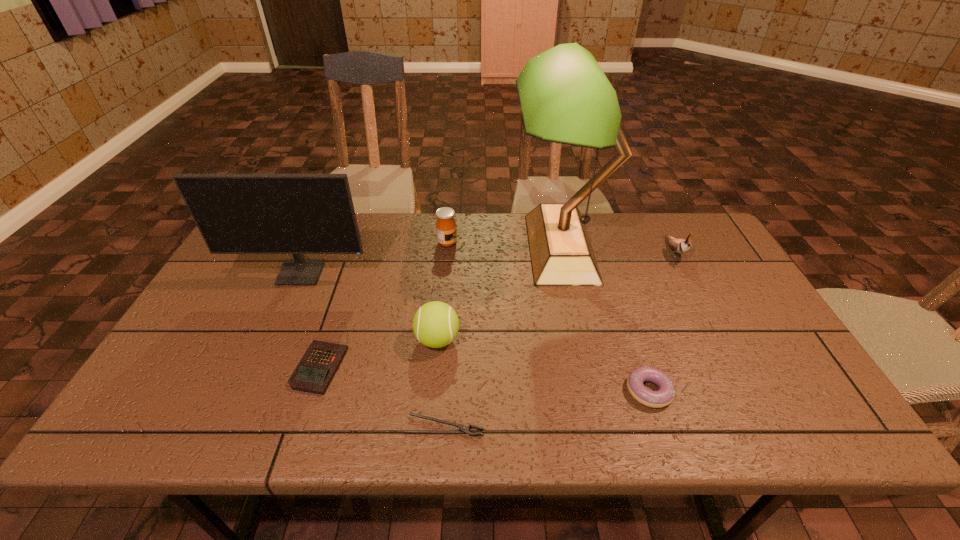
Where is `table lamp`? This screenshot has width=960, height=540. table lamp is located at coordinates (565, 97).

Where is `computer monitor`? The height and width of the screenshot is (540, 960). computer monitor is located at coordinates (297, 214).

This screenshot has height=540, width=960. Identify the location of honey. (446, 231).

Locate an element on the screen. This screenshot has width=960, height=540. bird is located at coordinates (681, 246).

The height and width of the screenshot is (540, 960). I want to click on tennis ball, so click(435, 324).

The height and width of the screenshot is (540, 960). Find the location of `doughnut`. doughnut is located at coordinates (665, 395).

Locate an element on the screen. the seventh tallest object is located at coordinates (316, 369).

Identify the location of tongs. (463, 429).

The image size is (960, 540). In order to click on the shortest object in this screenshot , I will do `click(463, 429)`.

Find the location of `vacant position located 0.290m on the metallic stand of the tallest object`. vacant position located 0.290m on the metallic stand of the tallest object is located at coordinates point(420,248).